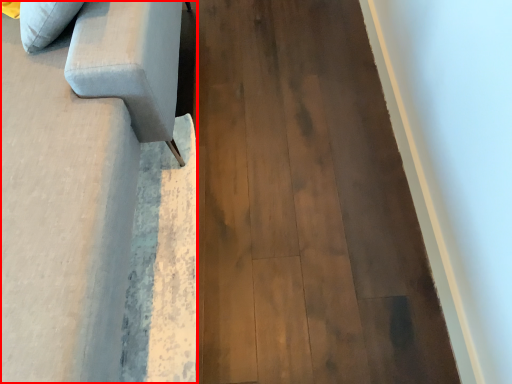
Question: Observing the image, what is the correct spatial positioning of furniture (annotated by the red box) in reference to plywood?

Choices:
 (A) left
 (B) right

Answer: (A)